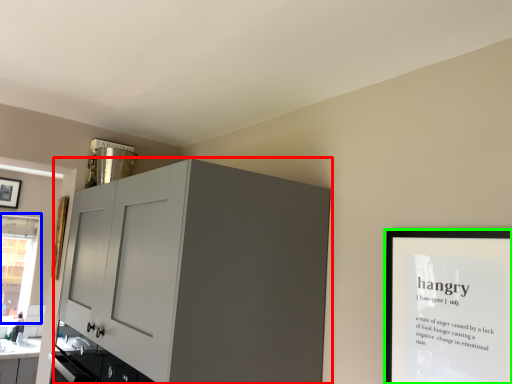
Question: Which object is the farthest from cabinetry (highlighted by a red box)? Choose among these: window (highlighted by a blue box) or picture frame (highlighted by a green box).

Choices:
 (A) window
 (B) picture frame

Answer: (A)